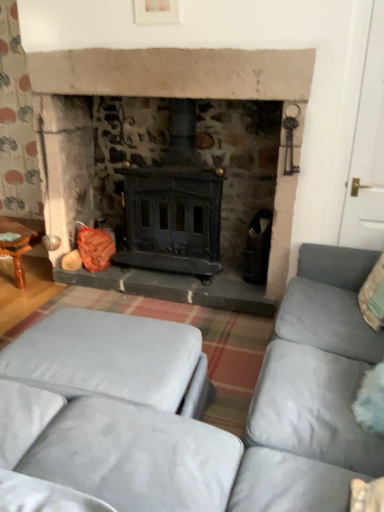
Question: Can you confirm if velvet grey ottoman at lower left is bigger than velvet grey couch at center?

Choices:
 (A) yes
 (B) no

Answer: (B)

Question: Does velvet grey ottoman at lower left touch velvet grey couch at center?

Choices:
 (A) no
 (B) yes

Answer: (A)

Question: Can you confirm if velvet grey ottoman at lower left is wider than velvet grey couch at center?

Choices:
 (A) no
 (B) yes

Answer: (A)

Question: Can you confirm if velvet grey ottoman at lower left is smaller than velvet grey couch at center?

Choices:
 (A) no
 (B) yes

Answer: (B)

Question: Is velvet grey ottoman at lower left located outside velvet grey couch at center?

Choices:
 (A) no
 (B) yes

Answer: (B)

Question: From the image's perspective, is velvet grey ottoman at lower left positioned above or below velvet grey couch at center?

Choices:
 (A) above
 (B) below

Answer: (B)

Question: Is velvet grey ottoman at lower left bigger or smaller than velvet grey couch at center?

Choices:
 (A) small
 (B) big

Answer: (A)

Question: From a real-world perspective, is velvet grey ottoman at lower left above or below velvet grey couch at center?

Choices:
 (A) above
 (B) below

Answer: (B)

Question: Is velvet grey ottoman at lower left wider or thinner than velvet grey couch at center?

Choices:
 (A) wide
 (B) thin

Answer: (B)

Question: Is point (243, 492) positioned closer to the camera than point (13, 224)?

Choices:
 (A) farther
 (B) closer

Answer: (B)

Question: From the image's perspective, is velvet grey couch at center located above or below wooden table at left?

Choices:
 (A) below
 (B) above

Answer: (A)

Question: Looking at their shapes, would you say velvet grey couch at center is wider or thinner than wooden table at left?

Choices:
 (A) thin
 (B) wide

Answer: (B)

Question: Relative to wooden table at left, is velvet grey couch at center in front or behind?

Choices:
 (A) front
 (B) behind

Answer: (A)

Question: Looking at the image, does velvet grey couch at center seem bigger or smaller compared to velvet grey ottoman at lower left?

Choices:
 (A) big
 (B) small

Answer: (A)

Question: Considering the positions of velvet grey couch at center and velvet grey ottoman at lower left in the image, is velvet grey couch at center taller or shorter than velvet grey ottoman at lower left?

Choices:
 (A) tall
 (B) short

Answer: (A)